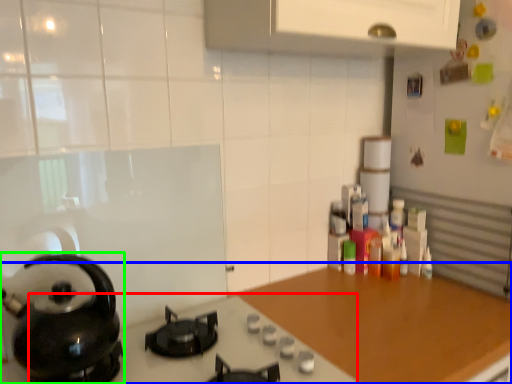
Question: Which is farther away from gas stove (highlighted by a red box)? countertop (highlighted by a blue box) or kitchen appliance (highlighted by a green box)?

Choices:
 (A) countertop
 (B) kitchen appliance

Answer: (B)